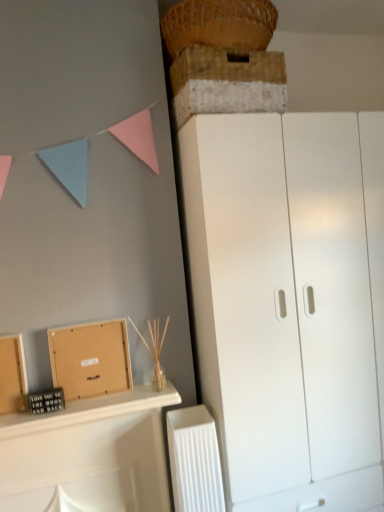
Question: Is white plastic radiator at lower center wider or thinner than woven straw basket at upper center?

Choices:
 (A) wide
 (B) thin

Answer: (B)

Question: Does point (210, 486) appear closer or farther from the camera than point (249, 24)?

Choices:
 (A) farther
 (B) closer

Answer: (A)

Question: Considering the real-world distances, which object is farthest from the white matte cupboard at right?

Choices:
 (A) brown cardboard box at lower left
 (B) wooden at left
 (C) white plastic radiator at lower center
 (D) woven straw basket at upper center
 (E) rustic wooden crate at upper center

Answer: (D)

Question: Based on their relative distances, which object is nearer to the woven straw basket at upper center?

Choices:
 (A) white matte cupboard at right
 (B) white plastic radiator at lower center
 (C) wooden at left
 (D) brown cardboard box at lower left
 (E) rustic wooden crate at upper center

Answer: (E)